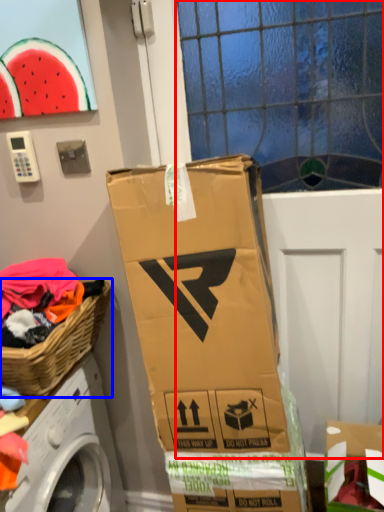
Question: Which point is closer to the camera, glass door (highlighted by a red box) or picnic basket (highlighted by a blue box)?

Choices:
 (A) glass door
 (B) picnic basket

Answer: (B)